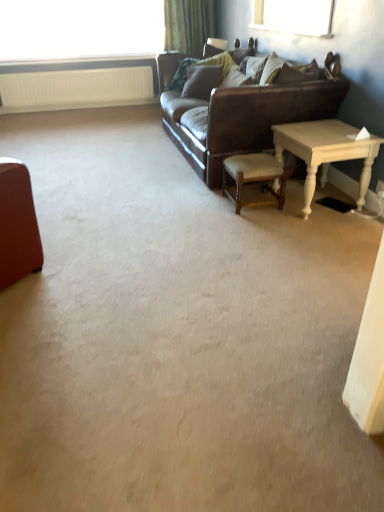
Locate an element on the screen. The height and width of the screenshot is (512, 384). vacant space positioned to the left of wooden chair at center is located at coordinates (203, 204).